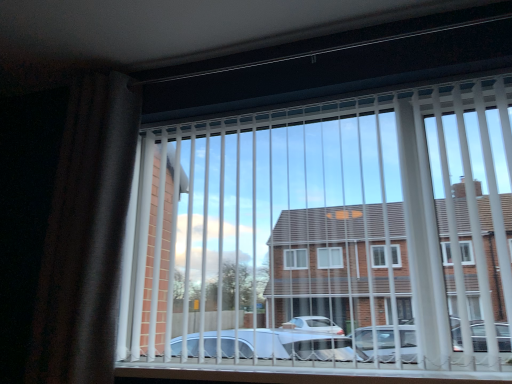
Question: From the image's perspective, is dark fabric curtain at left on white plastic blinds at center?

Choices:
 (A) yes
 (B) no

Answer: (A)

Question: Is dark fabric curtain at left beside white plastic blinds at center?

Choices:
 (A) yes
 (B) no

Answer: (B)

Question: Considering the relative sizes of dark fabric curtain at left and white plastic blinds at center in the image provided, is dark fabric curtain at left taller than white plastic blinds at center?

Choices:
 (A) no
 (B) yes

Answer: (B)

Question: Can you confirm if dark fabric curtain at left is positioned to the left of white plastic blinds at center?

Choices:
 (A) yes
 (B) no

Answer: (A)

Question: From a real-world perspective, is dark fabric curtain at left on top of white plastic blinds at center?

Choices:
 (A) no
 (B) yes

Answer: (B)

Question: Is dark fabric curtain at left further to the viewer compared to white plastic blinds at center?

Choices:
 (A) yes
 (B) no

Answer: (A)

Question: Can you confirm if white plastic blinds at center is wider than dark fabric curtain at left?

Choices:
 (A) yes
 (B) no

Answer: (B)

Question: Is white plastic blinds at center taller than dark fabric curtain at left?

Choices:
 (A) yes
 (B) no

Answer: (B)

Question: Does white plastic blinds at center have a lesser width compared to dark fabric curtain at left?

Choices:
 (A) no
 (B) yes

Answer: (B)

Question: From a real-world perspective, does white plastic blinds at center sit lower than dark fabric curtain at left?

Choices:
 (A) no
 (B) yes

Answer: (B)

Question: Is the position of white plastic blinds at center less distant than that of dark fabric curtain at left?

Choices:
 (A) no
 (B) yes

Answer: (B)

Question: Could you tell me if white plastic blinds at center is facing dark fabric curtain at left?

Choices:
 (A) no
 (B) yes

Answer: (A)

Question: Looking at the image, does white plastic blinds at center seem bigger or smaller compared to dark fabric curtain at left?

Choices:
 (A) small
 (B) big

Answer: (B)